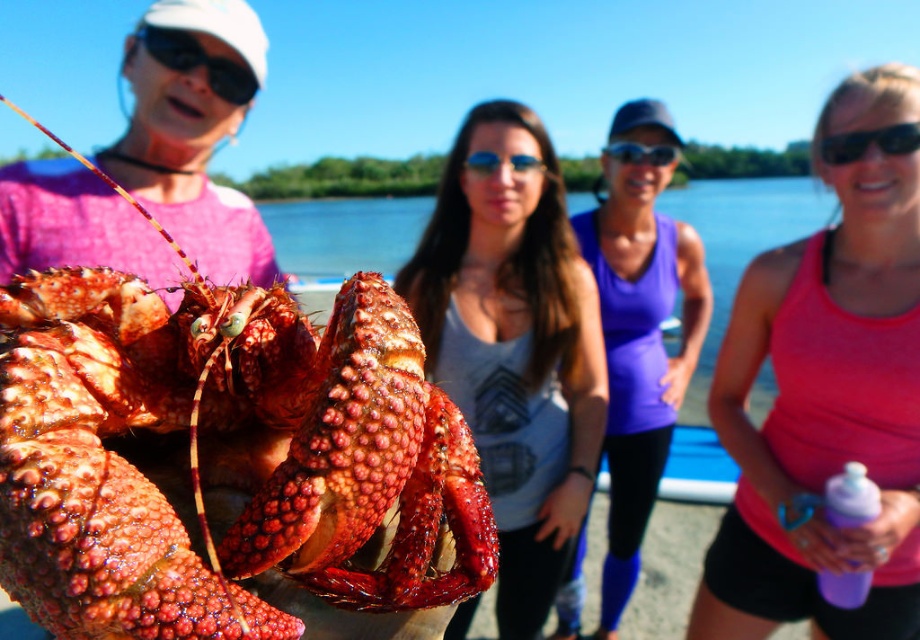
Does purple fabric tank top at center have a lesser height compared to glossy plastic goggles at center?

Incorrect, purple fabric tank top at center's height does not fall short of glossy plastic goggles at center's.

Does purple fabric tank top at center appear on the right side of glossy plastic goggles at center?

In fact, purple fabric tank top at center is to the left of glossy plastic goggles at center.

Identify the location of purple fabric tank top at center. click(x=639, y=333).

Is black plastic goggles at upper left bigger than black plastic sunglasses at upper right?

Yes.

Is black plastic goggles at upper left positioned in front of black plastic sunglasses at upper right?

No.

Between point (167, 65) and point (823, 136), which one is positioned in front?

Point (823, 136) is in front.

Find the location of a particular element. The height and width of the screenshot is (640, 920). black plastic goggles at upper left is located at coordinates (198, 61).

Is point (247, 390) closer to camera compared to point (594, 394)?

Yes, point (247, 390) is in front of point (594, 394).

Who is higher up, shiny red lobster at left or matte gray tank top at center?

shiny red lobster at left

Is point (282, 512) closer to camera compared to point (571, 406)?

That is True.

Find the location of a particular element. The height and width of the screenshot is (640, 920). shiny red lobster at left is located at coordinates (199, 456).